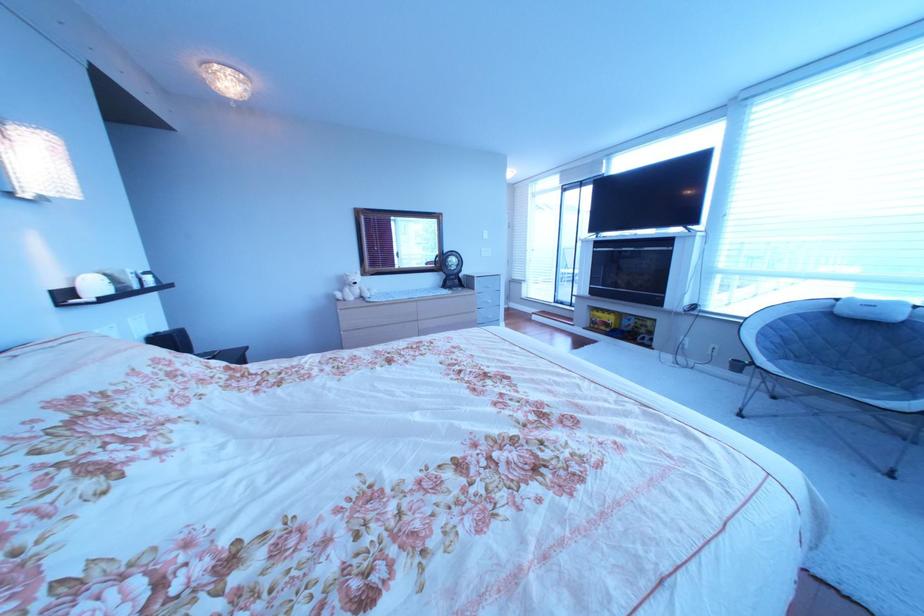
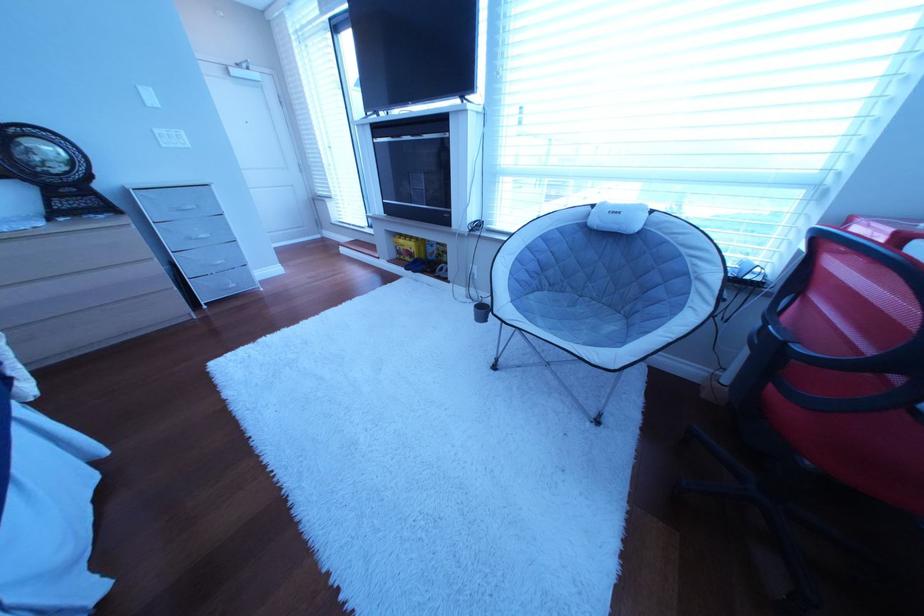
Locate, in the second image, the point that corresponds to point (614, 322) in the first image.

(418, 251)